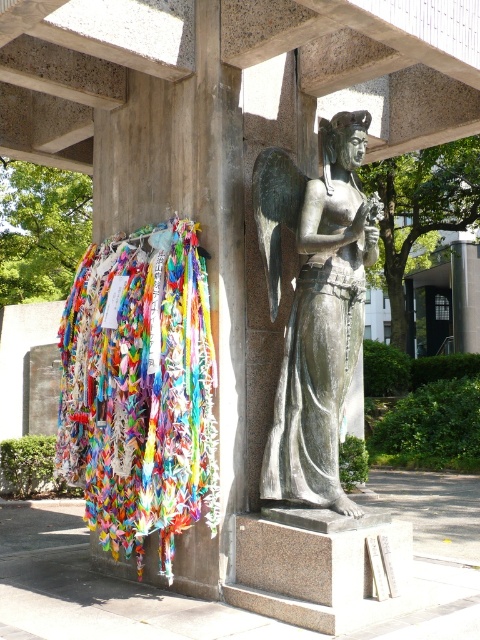
You are an artist planning to paint this scene. You want to ensure that the multicolored paper cranes at left and the bronze statue at center are proportionally accurate in your painting. Based on the scene, which object should you depict as wider in your artwork?

The multicolored paper cranes at left might be wider than the bronze statue at center, so in the painting, the multicolored paper cranes at left should be depicted as wider than the bronze statue at center.

You are a visitor standing in front of the bronze statue at center and want to take a photo of the multicolored paper cranes at left. Since the statue is in the way, can you move around it to get a clear shot? Explain your reasoning based on their heights.

The multicolored paper cranes at left has a lesser height compared to bronze statue at center. Since the bronze statue is taller, you might not be able to see the cranes clearly if the statue blocks your view. Moving around the statue to a position where it no longer obstructs the view would likely be necessary to capture the cranes properly.